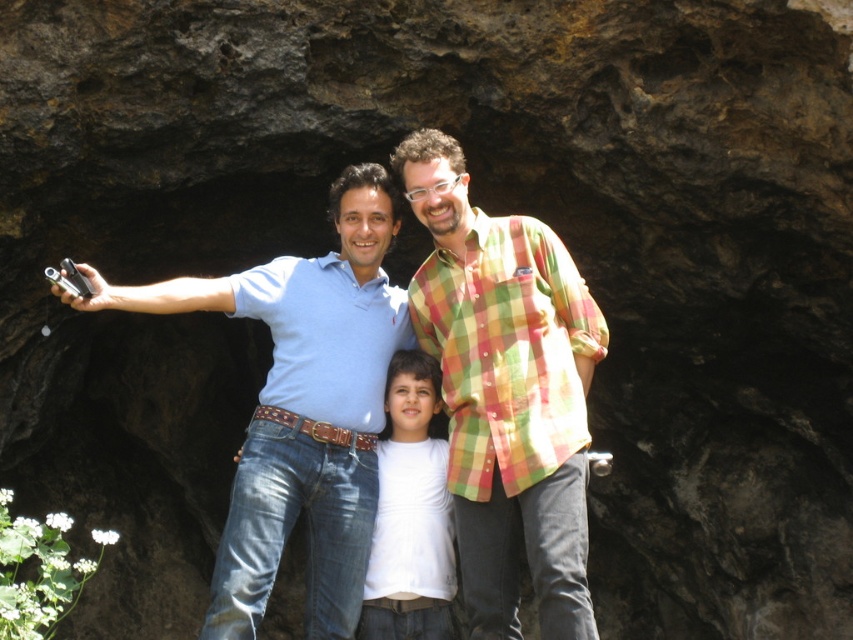
Question: Is checkered fabric shirt at center positioned at the back of white matte shirt at center?

Choices:
 (A) no
 (B) yes

Answer: (A)

Question: Is checkered fabric shirt at center above matte blue shirt at center?

Choices:
 (A) yes
 (B) no

Answer: (B)

Question: Which of the following is the farthest from the observer?

Choices:
 (A) (509, 632)
 (B) (346, 385)
 (C) (399, 605)

Answer: (B)

Question: Estimate the real-world distances between objects in this image. Which object is farther from the matte blue shirt at center?

Choices:
 (A) checkered fabric shirt at center
 (B) white matte shirt at center

Answer: (A)

Question: Which point is farther to the camera?

Choices:
 (A) (474, 298)
 (B) (387, 445)

Answer: (B)

Question: Can you confirm if checkered fabric shirt at center is wider than white matte shirt at center?

Choices:
 (A) yes
 (B) no

Answer: (A)